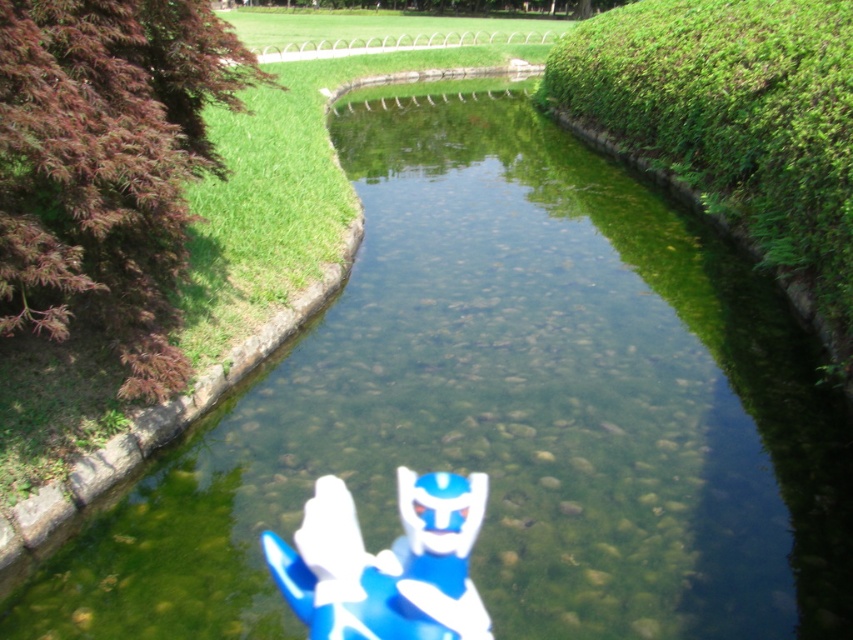
Measure the distance between point (601,17) and camera.

A distance of 19.06 meters exists between point (601,17) and camera.

Which of these two, green leafy hedge at right or blue plastic toy at center, stands taller?

green leafy hedge at right is taller.

The width and height of the screenshot is (853, 640). Identify the location of green leafy hedge at right. (735, 125).

The width and height of the screenshot is (853, 640). Identify the location of green leafy hedge at right. (735, 125).

Can you confirm if purple leafy hedge at left is shorter than blue plastic toy at center?

No.

Locate an element on the screen. This screenshot has height=640, width=853. purple leafy hedge at left is located at coordinates (107, 166).

Who is more distant from viewer, (109, 124) or (824, 330)?

Positioned behind is point (824, 330).

Where is `purple leafy hedge at left`? purple leafy hedge at left is located at coordinates (107, 166).